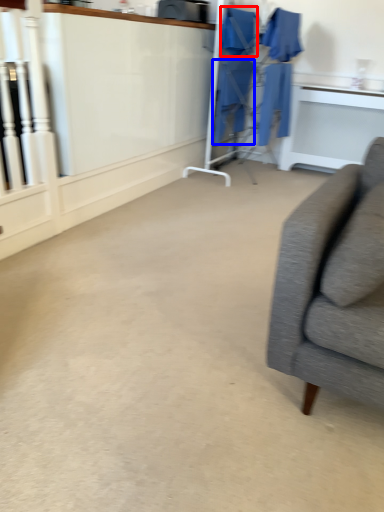
Question: Which object appears farthest to the camera in this image, robe (highlighted by a red box) or robe (highlighted by a blue box)?

Choices:
 (A) robe
 (B) robe

Answer: (B)